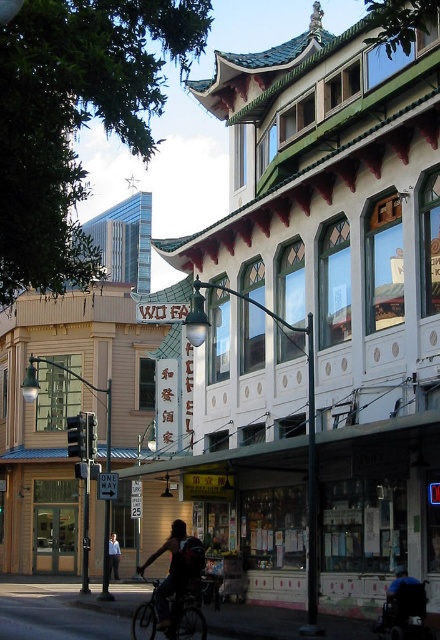
Consider the image. Does shiny metallic bicycle at center have a lesser height compared to dark blue shirt at center?

No.

The image size is (440, 640). What are the coordinates of `shiny metallic bicycle at center` in the screenshot? It's located at (172, 614).